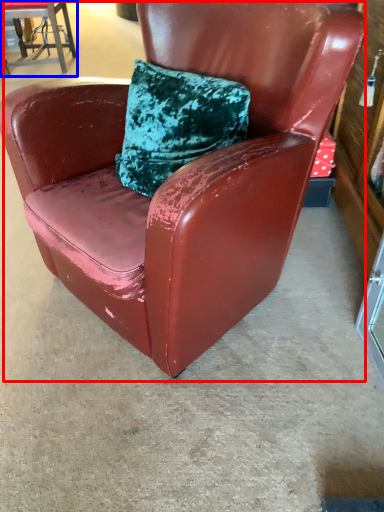
Question: Among these objects, which one is farthest to the camera, chair (highlighted by a red box) or chair (highlighted by a blue box)?

Choices:
 (A) chair
 (B) chair

Answer: (B)